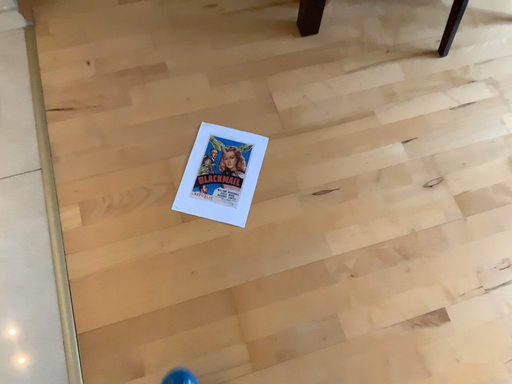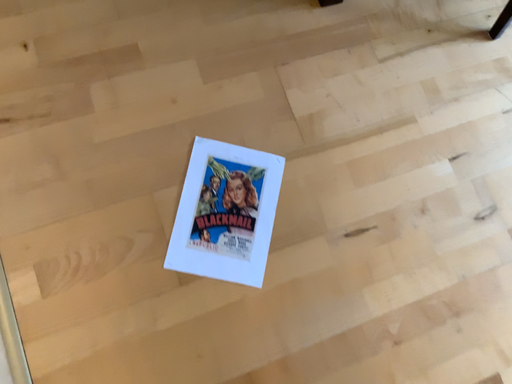
Question: Which way did the camera rotate in the video?

Choices:
 (A) rotated right
 (B) rotated left

Answer: (A)